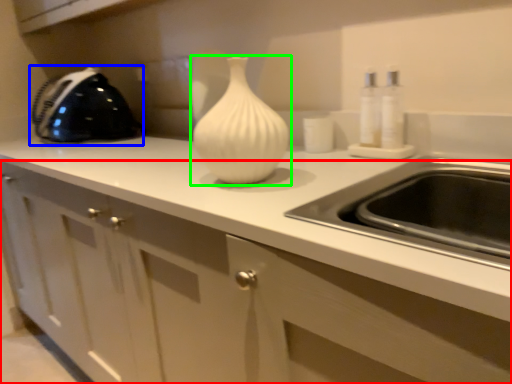
Question: Considering the real-world distances, which object is closest to cabinetry (highlighted by a red box)? appliance (highlighted by a blue box) or vase (highlighted by a green box).

Choices:
 (A) appliance
 (B) vase

Answer: (B)